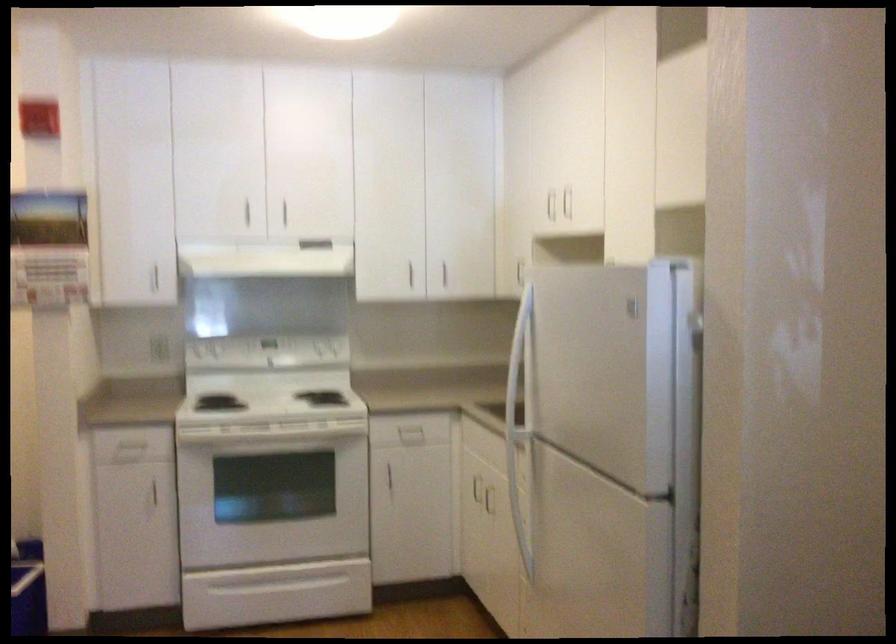
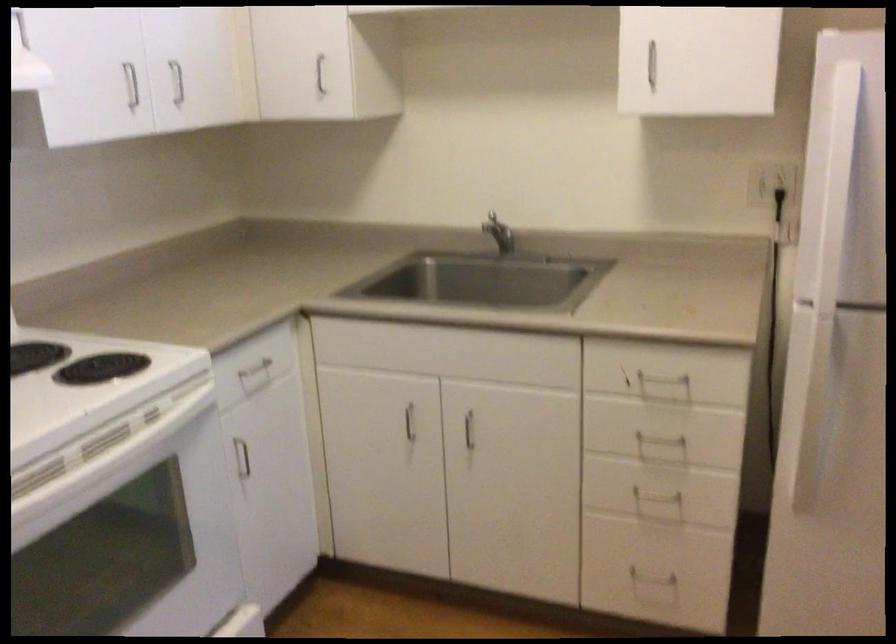
In the second image, find the point that corresponds to pixel 280 428 in the first image.

(108, 459)